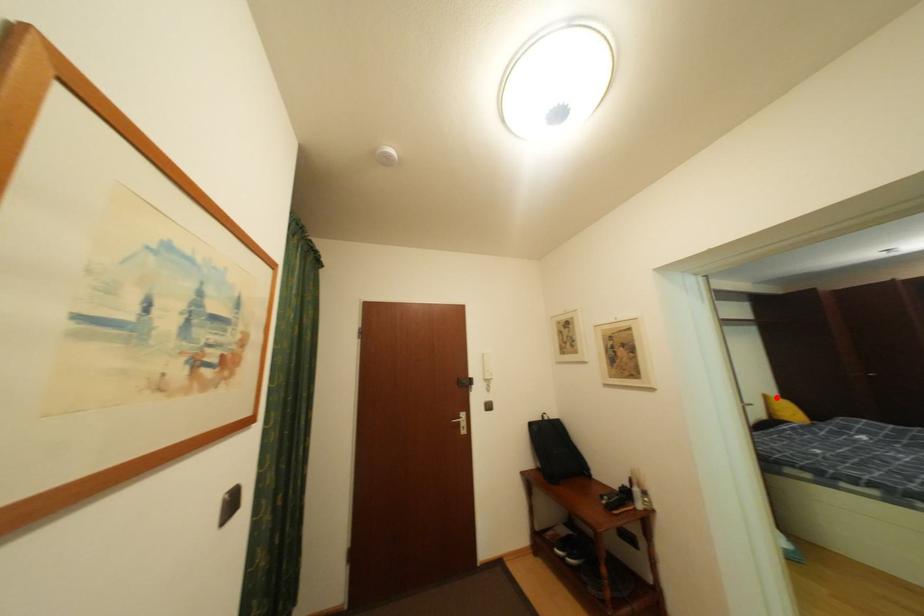
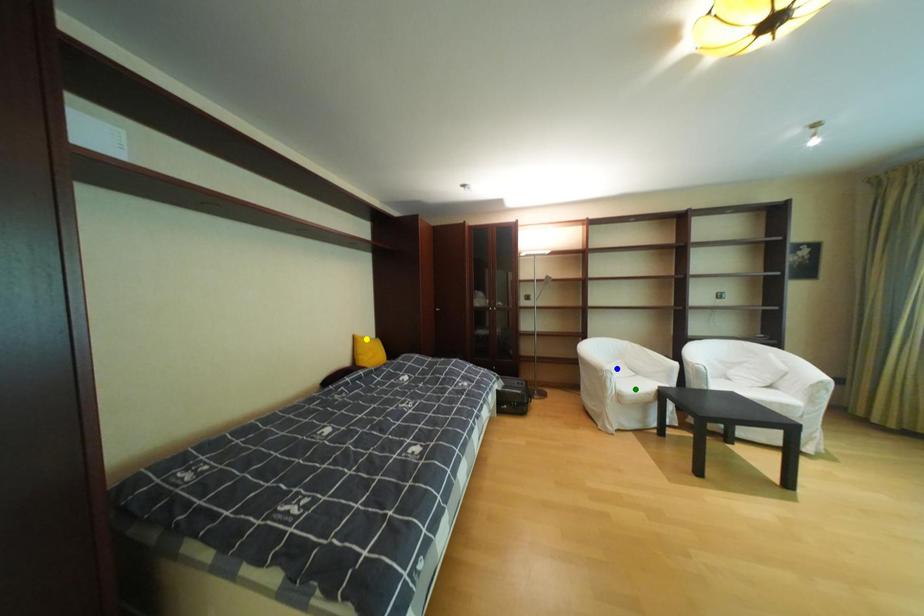
Question: I am providing you with two images of the same scene from different viewpoints. A red point is marked on the first image. You are given multiple points on the second image. Which mark in image 2 goes with the point in image 1?

Choices:
 (A) yellow point
 (B) blue point
 (C) green point

Answer: (A)